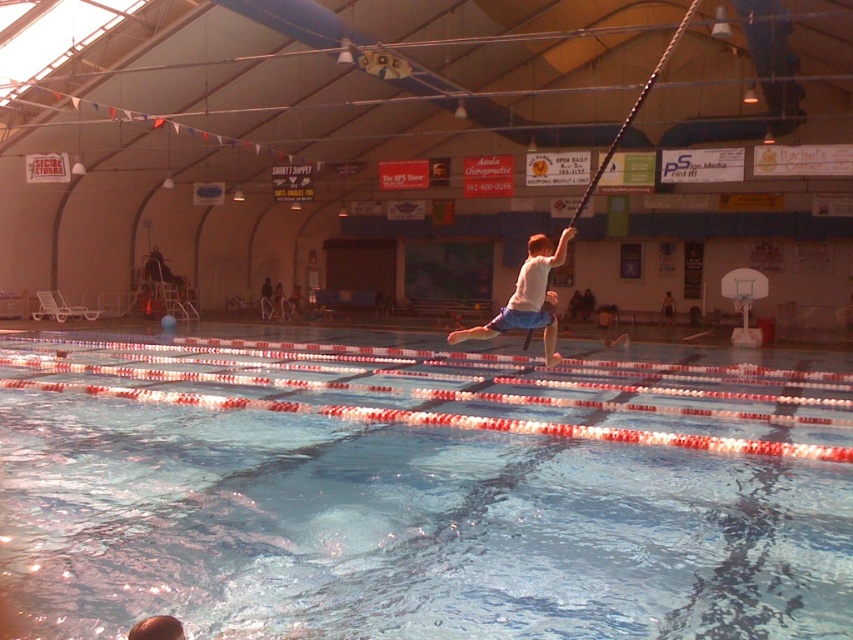
You are a lifeguard observing a swimmer wearing a white matte shirt at center and light brown shorts at center. Can you tell me if the swimmer is wearing the shirt over the shorts?

→ The white matte shirt at center is positioned over light brown shorts at center, so yes, the swimmer is wearing the shirt over the shorts.